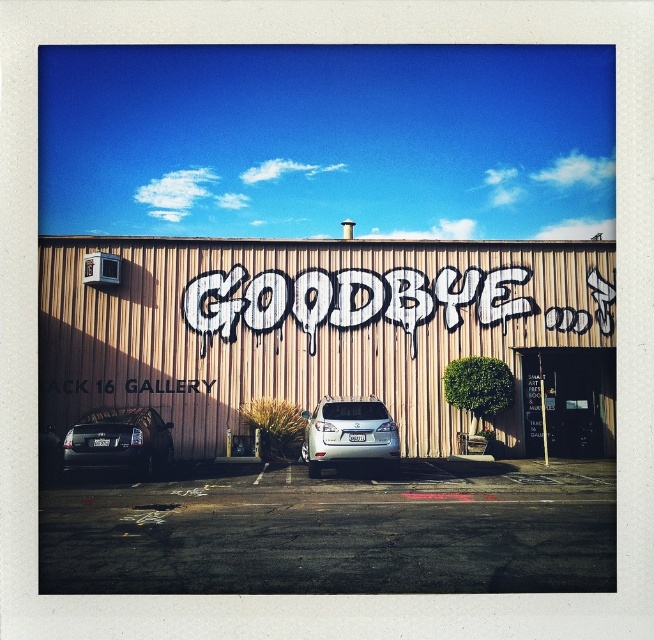
Question: Is white graffiti at center to the left of shiny black sedan at lower left from the viewer's perspective?

Choices:
 (A) no
 (B) yes

Answer: (A)

Question: Observing the image, what is the correct spatial positioning of white graffiti at center in reference to satin silver suv at center?

Choices:
 (A) right
 (B) left

Answer: (A)

Question: Among these objects, which one is farthest from the camera?

Choices:
 (A) shiny black sedan at lower left
 (B) white graffiti at center

Answer: (B)

Question: Is shiny black sedan at lower left positioned before satin silver suv at center?

Choices:
 (A) yes
 (B) no

Answer: (A)

Question: Which object appears farthest from the camera in this image?

Choices:
 (A) white graffiti at center
 (B) satin silver suv at center
 (C) shiny black sedan at lower left

Answer: (A)

Question: Which of the following is the closest to the observer?

Choices:
 (A) white graffiti at center
 (B) satin silver suv at center

Answer: (B)